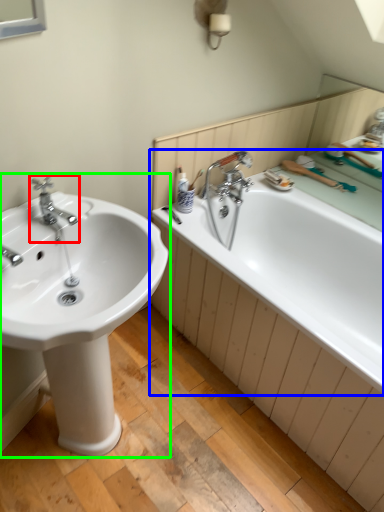
Question: Which object is the farthest from tap (highlighted by a red box)? Choose among these: bathtub (highlighted by a blue box) or sink (highlighted by a green box).

Choices:
 (A) bathtub
 (B) sink

Answer: (A)